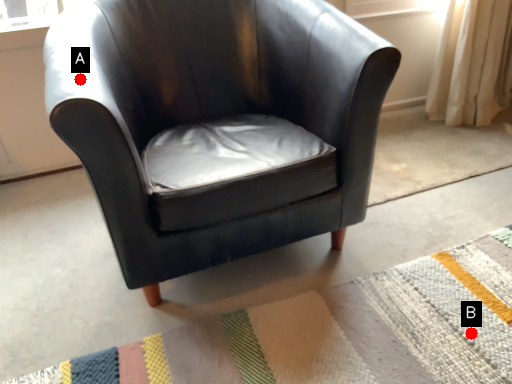
Question: Two points are circled on the image, labeled by A and B beside each circle. Which point appears closest to the camera in this image?

Choices:
 (A) A is closer
 (B) B is closer

Answer: (A)